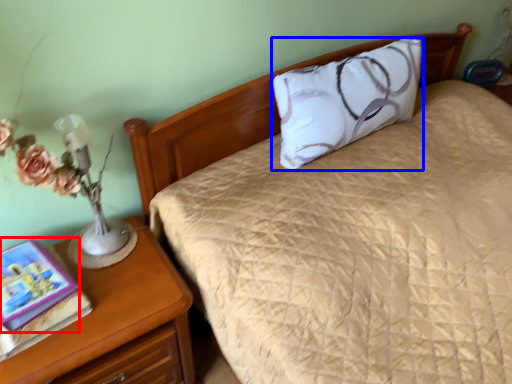
Question: Which object is further to the camera taking this photo, book (highlighted by a red box) or pillow (highlighted by a blue box)?

Choices:
 (A) book
 (B) pillow

Answer: (B)